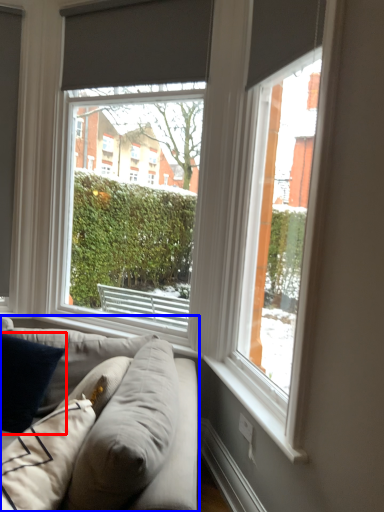
Question: Which point is further to the camera, pillow (highlighted by a red box) or studio couch (highlighted by a blue box)?

Choices:
 (A) pillow
 (B) studio couch

Answer: (A)